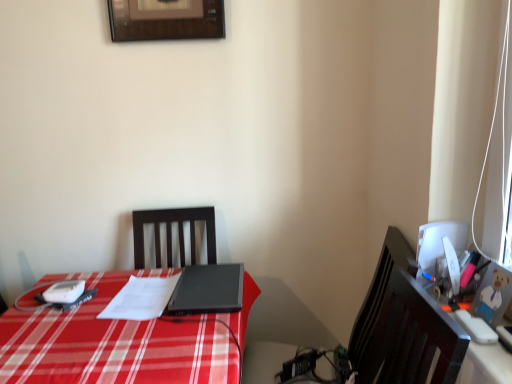
Question: From a real-world perspective, is orange plastic toy at right positioned under black matte laptop at center based on gravity?

Choices:
 (A) no
 (B) yes

Answer: (A)

Question: Does orange plastic toy at right have a greater height compared to black matte laptop at center?

Choices:
 (A) yes
 (B) no

Answer: (B)

Question: Is orange plastic toy at right further to camera compared to black matte laptop at center?

Choices:
 (A) yes
 (B) no

Answer: (B)

Question: Does orange plastic toy at right have a larger size compared to black matte laptop at center?

Choices:
 (A) no
 (B) yes

Answer: (A)

Question: Considering the relative positions of orange plastic toy at right and black matte laptop at center in the image provided, is orange plastic toy at right to the right of black matte laptop at center from the viewer's perspective?

Choices:
 (A) yes
 (B) no

Answer: (A)

Question: Is white paper at center in front of or behind black matte laptop at center in the image?

Choices:
 (A) front
 (B) behind

Answer: (A)

Question: Considering the positions of white paper at center and black matte laptop at center in the image, is white paper at center bigger or smaller than black matte laptop at center?

Choices:
 (A) small
 (B) big

Answer: (A)

Question: Is white paper at center inside the boundaries of black matte laptop at center, or outside?

Choices:
 (A) inside
 (B) outside

Answer: (B)

Question: In terms of height, does white paper at center look taller or shorter compared to black matte laptop at center?

Choices:
 (A) short
 (B) tall

Answer: (A)

Question: From the image's perspective, is white glossy computer monitor at right located above or below orange plastic toy at right?

Choices:
 (A) above
 (B) below

Answer: (A)

Question: In the image, is white glossy computer monitor at right positioned in front of or behind orange plastic toy at right?

Choices:
 (A) front
 (B) behind

Answer: (B)

Question: From a real-world perspective, is white glossy computer monitor at right above or below orange plastic toy at right?

Choices:
 (A) below
 (B) above

Answer: (B)

Question: Is point (440, 221) closer or farther from the camera than point (484, 365)?

Choices:
 (A) farther
 (B) closer

Answer: (A)

Question: Is black matte laptop at center inside the boundaries of orange plastic toy at right, or outside?

Choices:
 (A) outside
 (B) inside

Answer: (A)

Question: Considering the relative positions of black matte laptop at center and orange plastic toy at right in the image provided, is black matte laptop at center to the left or to the right of orange plastic toy at right?

Choices:
 (A) left
 (B) right

Answer: (A)